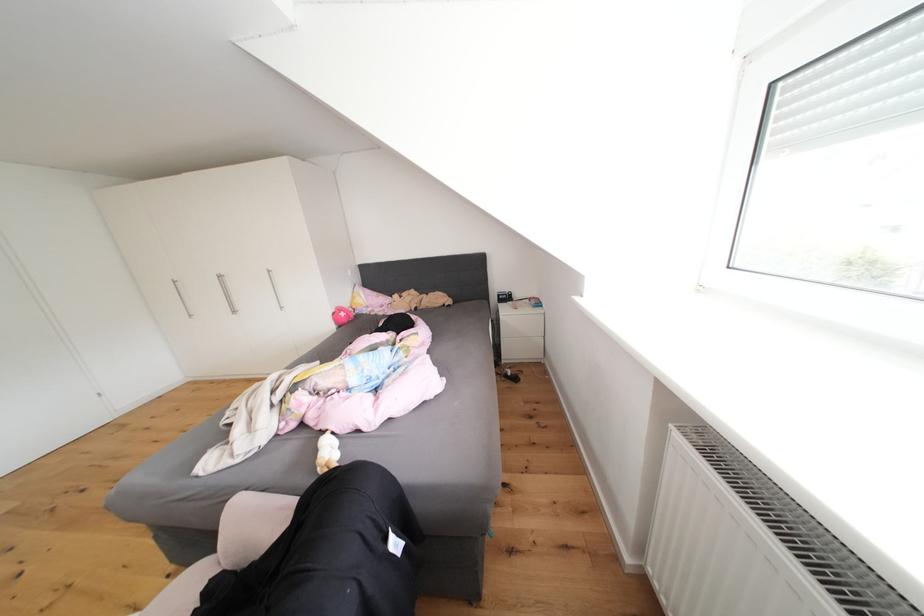
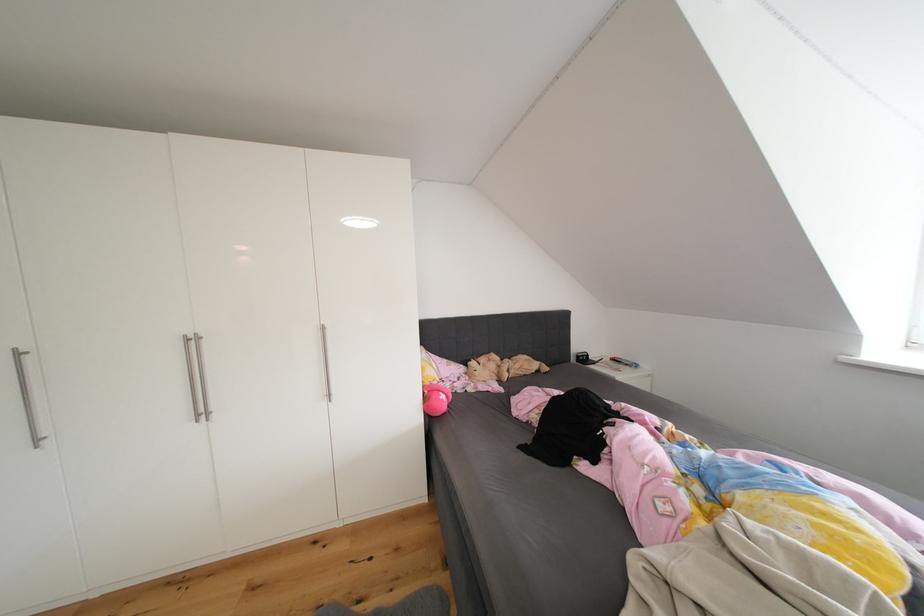
From the picture: In a continuous first-person perspective shot, in which direction is the camera moving?

The movement direction of the cameraman is left, forward.